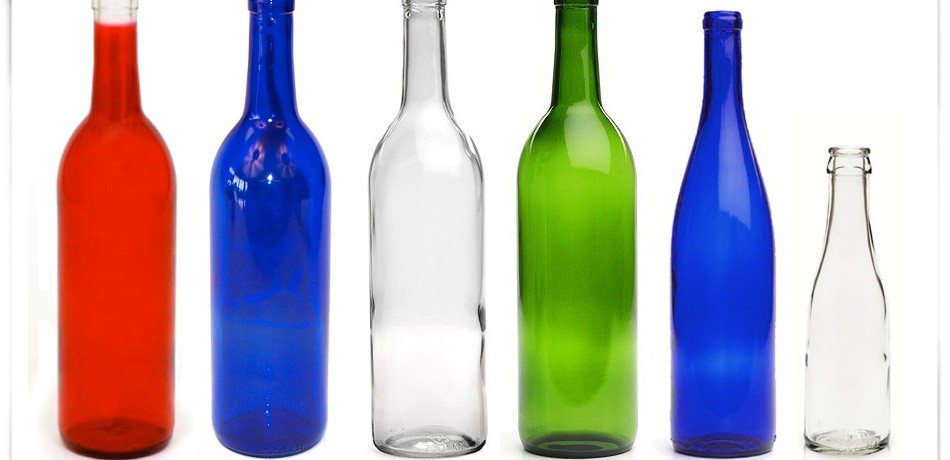
The height and width of the screenshot is (460, 950). I want to click on glass bottles with long narrow necks, so click(116, 367), click(279, 345), click(708, 369), click(587, 185), click(395, 198), click(846, 342).